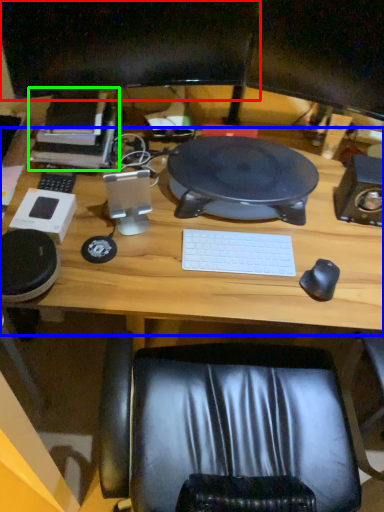
Question: Considering the real-world distances, which object is closest to computer monitor (highlighted by a red box)? computer desk (highlighted by a blue box) or book (highlighted by a green box).

Choices:
 (A) computer desk
 (B) book

Answer: (B)